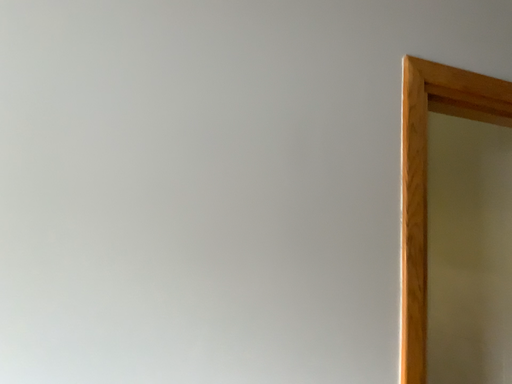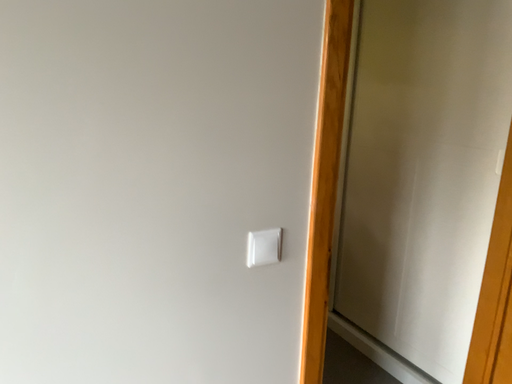
Question: Which way did the camera rotate in the video?

Choices:
 (A) rotated downward
 (B) rotated upward

Answer: (A)